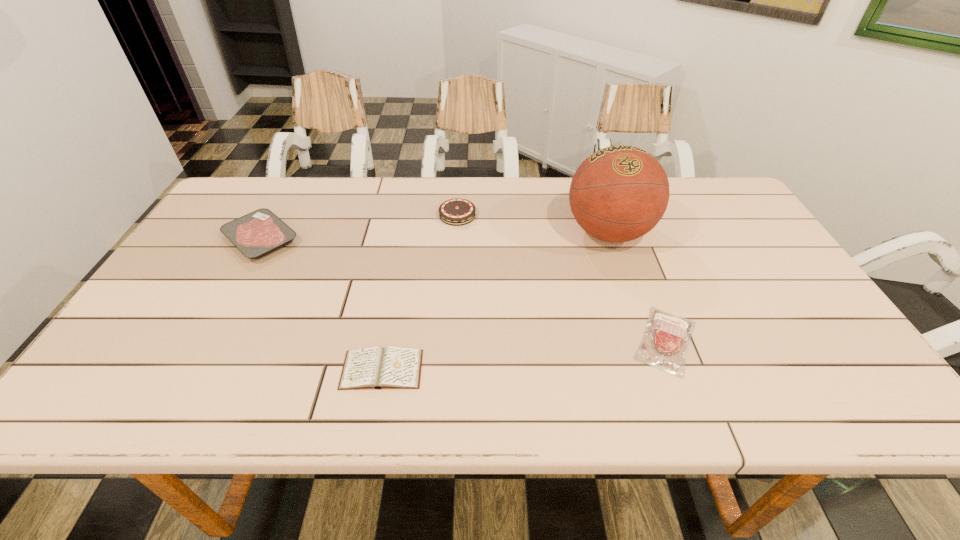
Find the location of a particular element. The image size is (960, 540). free spot at the near edge of the desktop is located at coordinates (468, 406).

Find the location of a particular element. vacant space at the left edge is located at coordinates (221, 247).

Find the location of a particular element. This screenshot has width=960, height=540. vacant position at the right edge of the desktop is located at coordinates (732, 254).

The width and height of the screenshot is (960, 540). Identify the location of vacant region at the near right corner of the desktop. (862, 385).

The width and height of the screenshot is (960, 540). Identify the location of free space between the shorter steak and the chocolate cake. (562, 278).

Where is `vacant space that is in between the nearer steak and the third shortest object`? vacant space that is in between the nearer steak and the third shortest object is located at coordinates (464, 289).

This screenshot has height=540, width=960. In order to click on free space that is in between the chocolate cake and the basketball in this screenshot , I will do `click(533, 224)`.

The width and height of the screenshot is (960, 540). What are the coordinates of `free space between the chocolate cake and the tallest object` in the screenshot? It's located at (533, 224).

The image size is (960, 540). I want to click on empty space that is in between the right steak and the basketball, so click(x=637, y=286).

At what (x,y) coordinates should I click in order to perform the action: click on unoccupied area between the diary and the fourth shortest object. Please return your answer as a coordinate pair (x, y). This screenshot has height=540, width=960. Looking at the image, I should click on 420,292.